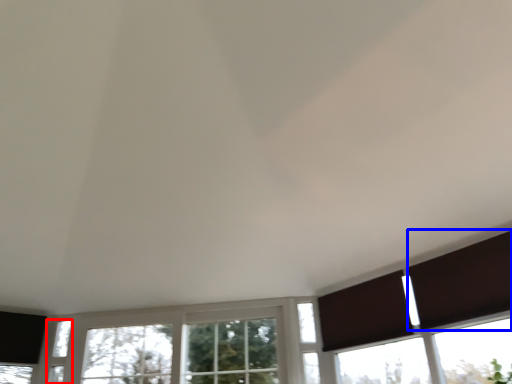
Question: Which point is further to the camera, window (highlighted by a red box) or shutter (highlighted by a blue box)?

Choices:
 (A) window
 (B) shutter

Answer: (A)